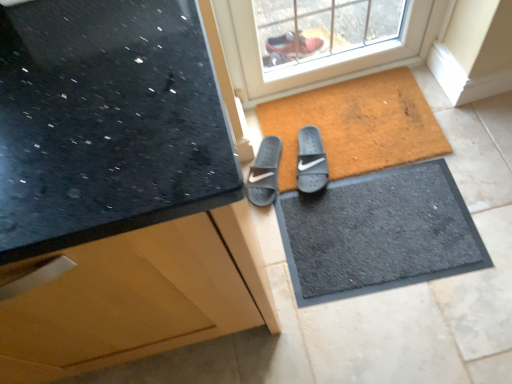
At what (x,y) coordinates should I click in order to perform the action: click on free spot in front of gray rubber slide at center, which is the 1th footwear in left-to-right order. Please return your answer as a coordinate pair (x, y). Looking at the image, I should click on (285, 215).